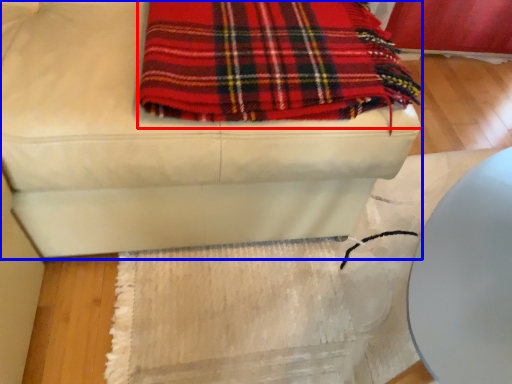
Question: Among these objects, which one is farthest to the camera, blanket (highlighted by a red box) or furniture (highlighted by a blue box)?

Choices:
 (A) blanket
 (B) furniture

Answer: (A)